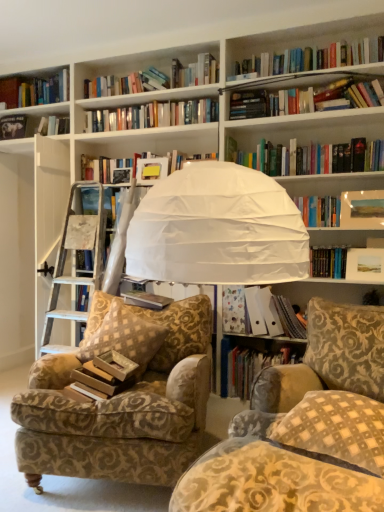
Question: Is hardcover book at center, the 2th book positioned from the left, looking in the opposite direction of gold-patterned fabric pillow at center-left, the 1th pillow positioned from the back?

Choices:
 (A) no
 (B) yes

Answer: (A)

Question: From a real-world perspective, is hardcover book at center, the third book positioned from the bottom, on gold-patterned fabric pillow at center-left, the second pillow in the front-to-back sequence?

Choices:
 (A) no
 (B) yes

Answer: (B)

Question: Is hardcover book at center, which is the second book in top-to-bottom order, bigger than gold-patterned fabric pillow at center-left, which ranks as the 1th pillow in left-to-right order?

Choices:
 (A) no
 (B) yes

Answer: (A)

Question: Can you confirm if hardcover book at center, which is the 3th book in right-to-left order, is thinner than gold-patterned fabric pillow at center-left, the second pillow in the front-to-back sequence?

Choices:
 (A) yes
 (B) no

Answer: (A)

Question: From the image's perspective, would you say hardcover book at center, the 2th book positioned from the left, is positioned over gold-patterned fabric pillow at center-left, the 2th pillow from the right?

Choices:
 (A) no
 (B) yes

Answer: (B)

Question: Is hardcover book at upper left, the fourth book when ordered from right to left, oriented away from patterned fabric armchair at left?

Choices:
 (A) no
 (B) yes

Answer: (A)

Question: Does hardcover book at upper left, which ranks as the 1th book in top-to-bottom order, have a smaller size compared to patterned fabric armchair at left?

Choices:
 (A) yes
 (B) no

Answer: (A)

Question: Considering the relative sizes of hardcover book at upper left, which ranks as the 1th book in top-to-bottom order, and patterned fabric armchair at left in the image provided, is hardcover book at upper left, which ranks as the 1th book in top-to-bottom order, bigger than patterned fabric armchair at left?

Choices:
 (A) yes
 (B) no

Answer: (B)

Question: Could you tell me if hardcover book at upper left, which is counted as the 1th book, starting from the left, is facing patterned fabric armchair at left?

Choices:
 (A) yes
 (B) no

Answer: (B)

Question: Is hardcover book at upper left, which ranks as the 1th book in top-to-bottom order, thinner than patterned fabric armchair at left?

Choices:
 (A) yes
 (B) no

Answer: (A)

Question: Could patterned fabric armchair at left be considered to be inside hardcover book at upper left, the fourth book when ordered from right to left?

Choices:
 (A) no
 (B) yes

Answer: (A)

Question: Can you confirm if matte paper folder at center right, marked as the first book in a right-to-left arrangement, is thinner than gold-patterned fabric pillow at center-left, the 2th pillow from the right?

Choices:
 (A) no
 (B) yes

Answer: (B)